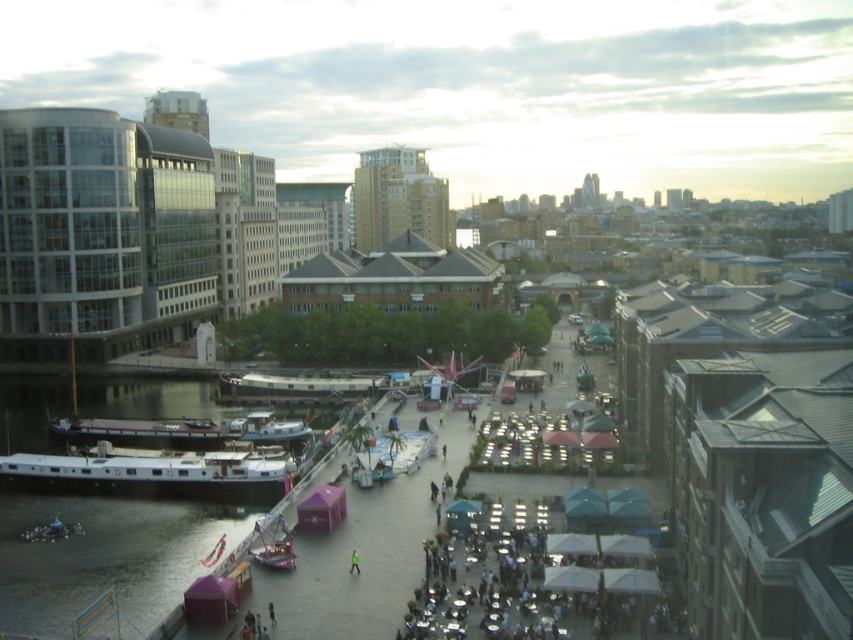
Identify the location of white glossy boat at lower left. This screenshot has height=640, width=853. (149, 474).

Between white glossy boat at lower left and white wooden boat at lower left, which one has more height?

With more height is white glossy boat at lower left.

You are a GUI agent. You are given a task and a screenshot of the screen. Output one action in this format:
    pyautogui.click(x=<x>, y=<y>)
    Task: Click on the white glossy boat at lower left
    
    Given the screenshot: What is the action you would take?
    pyautogui.click(x=149, y=474)

Between point (149, 440) and point (350, 556), which one is positioned behind?

The point (149, 440) is behind.

How much distance is there between white wooden boat at lower left and yellow reflective vest at center?

The distance of white wooden boat at lower left from yellow reflective vest at center is 41.54 meters.

Is point (155, 435) positioned in front of point (352, 552)?

No, (155, 435) is further to viewer.

What are the coordinates of `white wooden boat at lower left` in the screenshot? It's located at (178, 429).

Who is more forward, (167, 460) or (267, 545)?

Positioned in front is point (267, 545).

Is white glossy boat at lower left behind transparent glass boat at lower center?

Yes.

Between point (194, 472) and point (289, 538), which one is positioned in front?

Positioned in front is point (289, 538).

This screenshot has width=853, height=640. I want to click on white glossy boat at lower left, so click(x=149, y=474).